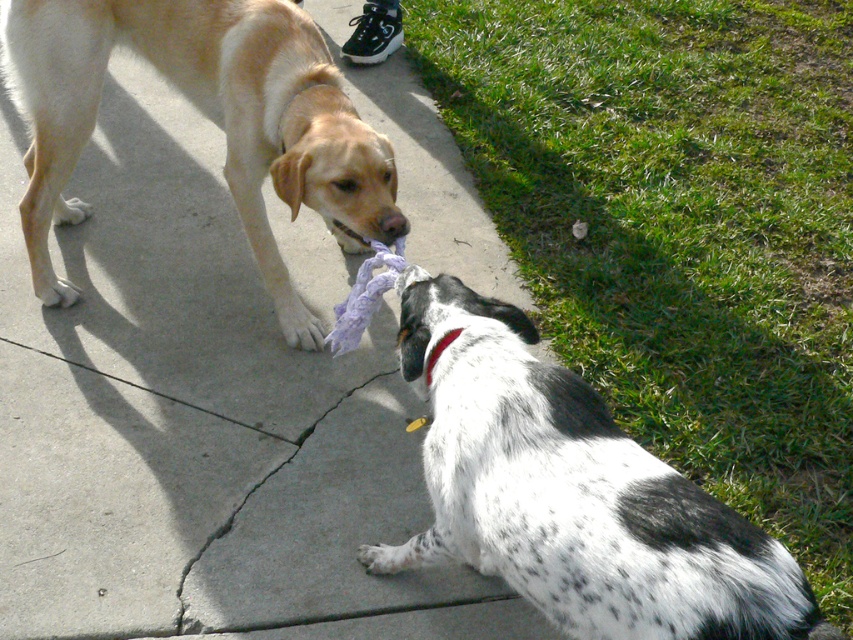
From the picture: You are a photographer setting up a camera at the back of the paved area. You want to take a photo that includes both the light brown fur at left and the black fabric neckband at center. Which object should you focus on first to ensure both are in the frame?

You should focus on the light brown fur at left first since it is closer to you than the black fabric neckband at center, ensuring both are in the frame by starting with the closer object.

You are a photographer trying to capture a photo of both the spotted fur dog at lower right and the light brown fur at left. Based on their positions, which dog is closer to the ground?

The spotted fur dog at lower right is positioned under light brown fur at left, so it is closer to the ground.

You are a dog trainer observing the scene. You need to determine which object is taller between the spotted fur dog at lower right and the black fabric neckband at center. Which one is taller?

The spotted fur dog at lower right is taller than the black fabric neckband at center.